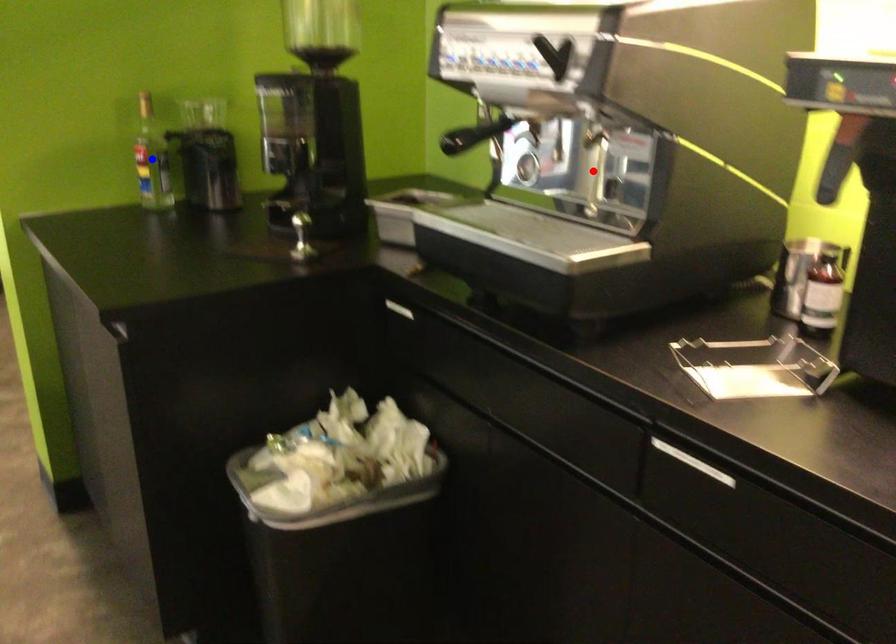
Question: Two points are marked on the image. Which point is closer to the camera?

Choices:
 (A) Blue point is closer.
 (B) Red point is closer.

Answer: (B)